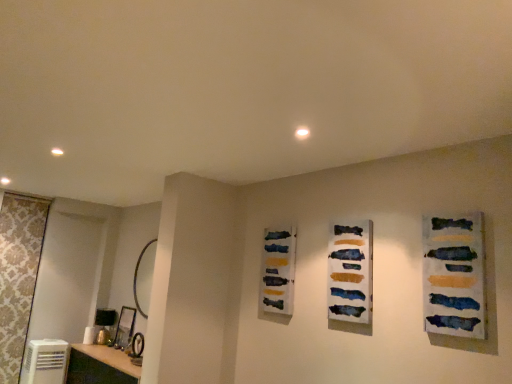
Question: Considering the relative sizes of white glossy vanity at lower left and gold metallic mirror at left in the image provided, is white glossy vanity at lower left thinner than gold metallic mirror at left?

Choices:
 (A) no
 (B) yes

Answer: (A)

Question: Are white glossy vanity at lower left and gold metallic mirror at left located far from each other?

Choices:
 (A) yes
 (B) no

Answer: (B)

Question: Is white glossy vanity at lower left located outside gold metallic mirror at left?

Choices:
 (A) no
 (B) yes

Answer: (B)

Question: From a real-world perspective, does white glossy vanity at lower left sit lower than gold metallic mirror at left?

Choices:
 (A) yes
 (B) no

Answer: (A)

Question: Is gold metallic mirror at left inside white glossy vanity at lower left?

Choices:
 (A) yes
 (B) no

Answer: (B)

Question: Which is correct: watercolor paint strips at center, positioned as the second art in back-to-front order, is inside watercolor paint palette at center, the 1th art positioned from the back, or outside of it?

Choices:
 (A) outside
 (B) inside

Answer: (A)

Question: Relative to watercolor paint palette at center, the 1th art when ordered from left to right, is watercolor paint strips at center, the 2th art positioned from the right, in front or behind?

Choices:
 (A) behind
 (B) front

Answer: (B)

Question: Is watercolor paint strips at center, arranged as the second art when viewed from the front, wider or thinner than watercolor paint palette at center, the 1th art when ordered from left to right?

Choices:
 (A) wide
 (B) thin

Answer: (B)

Question: Looking at the image, does watercolor paint strips at center, the 2th art positioned from the right, seem bigger or smaller compared to watercolor paint palette at center, the 1th art when ordered from left to right?

Choices:
 (A) big
 (B) small

Answer: (B)

Question: Relative to white glossy vanity at lower left, is gold metallic mirror at left in front or behind?

Choices:
 (A) front
 (B) behind

Answer: (B)

Question: From the image's perspective, is gold metallic mirror at left positioned above or below white glossy vanity at lower left?

Choices:
 (A) below
 (B) above

Answer: (B)

Question: Considering the relative positions of gold metallic mirror at left and white glossy vanity at lower left in the image provided, is gold metallic mirror at left to the left or to the right of white glossy vanity at lower left?

Choices:
 (A) left
 (B) right

Answer: (B)

Question: Is gold metallic mirror at left situated inside white glossy vanity at lower left or outside?

Choices:
 (A) inside
 (B) outside

Answer: (B)

Question: In terms of size, does textured canvas painting at right, positioned as the third art in back-to-front order, appear bigger or smaller than white plastic air conditioner at lower left?

Choices:
 (A) small
 (B) big

Answer: (A)

Question: Visually, is textured canvas painting at right, which is the 1th art in right-to-left order, positioned to the left or to the right of white plastic air conditioner at lower left?

Choices:
 (A) right
 (B) left

Answer: (A)